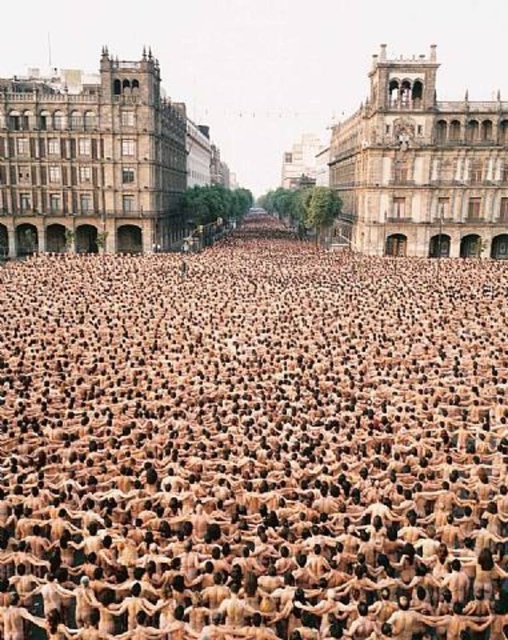
Question: Considering the real-world distances, which object is closest to the stone/brick building at center?

Choices:
 (A) brown human bodies at center
 (B) brown stone building at upper left

Answer: (A)

Question: Is brown human bodies at center thinner than brown stone building at upper left?

Choices:
 (A) no
 (B) yes

Answer: (A)

Question: Does brown human bodies at center appear on the left side of brown stone building at upper left?

Choices:
 (A) no
 (B) yes

Answer: (A)

Question: Which of the following is the closest to the observer?

Choices:
 (A) (454, 202)
 (B) (168, 104)

Answer: (A)

Question: Among these points, which one is nearest to the camera?

Choices:
 (A) (7, 179)
 (B) (404, 65)
 (C) (398, 547)

Answer: (C)

Question: Is brown human bodies at center thinner than brown stone building at upper left?

Choices:
 (A) no
 (B) yes

Answer: (A)